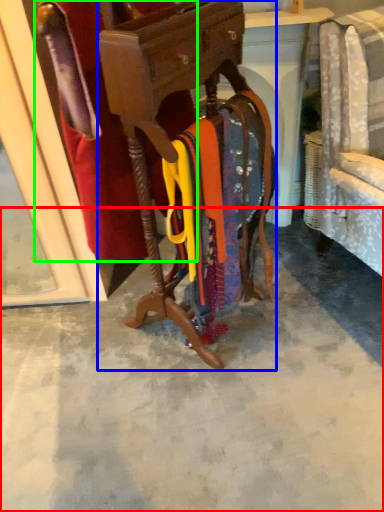
Question: Which object is positioned closest to concrete (highlighted by a red box)? Select from furniture (highlighted by a blue box) and robe (highlighted by a green box).

Choices:
 (A) furniture
 (B) robe

Answer: (A)